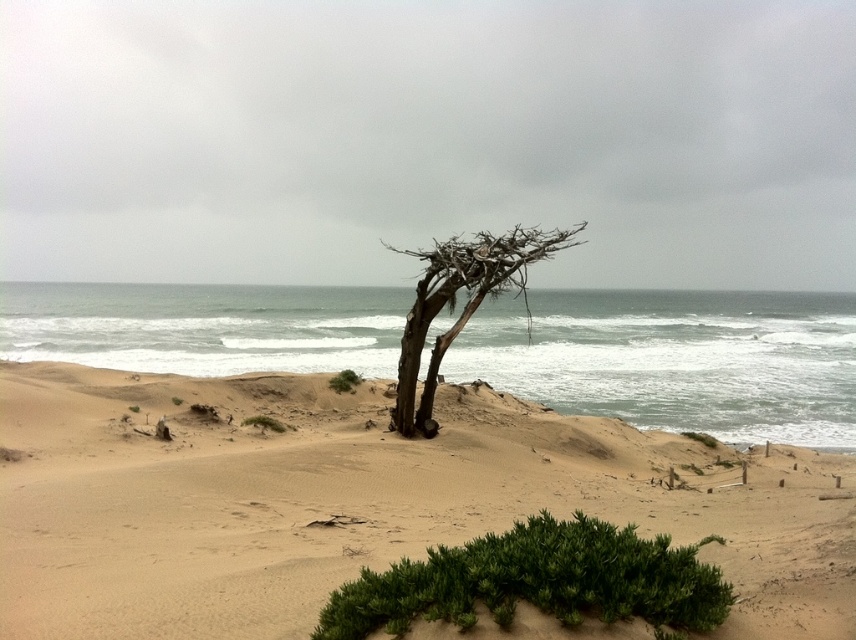
You are standing at the base of the weathered tree in the coastal scene. You notice two points marked in the image. Which point, point (496, 476) or point (531, 541), is closer to your current position?

Point (496, 476) is closer to your current position because it is further to the camera than point (531, 541).

You are a hiker who needs to place a 10 meter long rope between the green leafy bush at lower center and the brown rough tree at center. Will the rope be sufficient to stretch between them?

The distance between the green leafy bush at lower center and the brown rough tree at center is 10.30 meters. Since the rope is only 10 meters long, it will be 30 centimeters short and not sufficient to stretch between them.

You are a hiker who has lost your way on the coast. You see the sandy beige sand at center and the brown rough tree at center. Which direction should you walk to reach the tree from the sand?

The sandy beige sand at center and brown rough tree at center are 5.67 meters apart from each other. Since both are at the center, you should walk towards the tree in the direction where they are positioned relative to each other. However, without additional directional cues, it is impossible to determine the exact direction to walk.